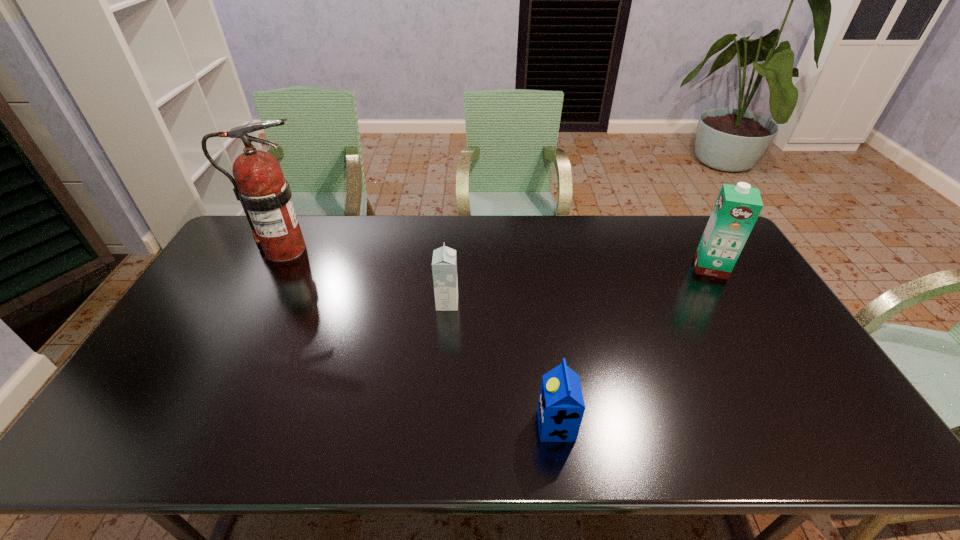
Where is `vacant region at the near edge of the desktop`? This screenshot has width=960, height=540. vacant region at the near edge of the desktop is located at coordinates (420, 438).

I want to click on free location at the near left corner, so click(133, 440).

Locate an element on the screen. This screenshot has height=540, width=960. vacant space that's between the rightmost object and the tallest object is located at coordinates (497, 258).

What are the coordinates of `unoccupied area between the leftmost object and the second object from right to left` in the screenshot? It's located at (420, 338).

Where is `empty location between the second tallest object and the nearest object`? The image size is (960, 540). empty location between the second tallest object and the nearest object is located at coordinates (634, 346).

Find the location of a particular element. This screenshot has width=960, height=540. free space between the farthest carton and the nearest object is located at coordinates (634, 346).

Find the location of `free point between the leftmost object and the rightmost object`. free point between the leftmost object and the rightmost object is located at coordinates (x=497, y=258).

Locate an element on the screen. blank region between the rightmost object and the leftmost object is located at coordinates pos(497,258).

The height and width of the screenshot is (540, 960). I want to click on free space between the farthest carton and the third object from right to left, so click(x=579, y=285).

What are the coordinates of `vacant area that lies between the nearest carton and the fire extinguisher` in the screenshot? It's located at click(420, 338).